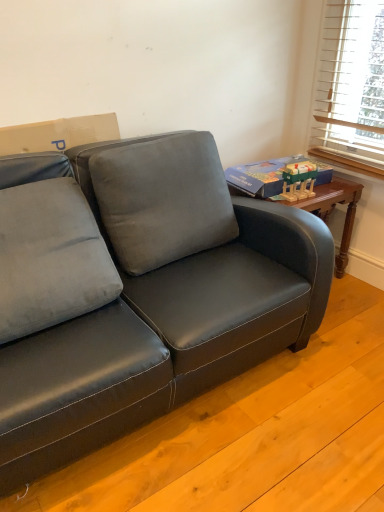
What is the approximate height of wooden block toy at upper right?

7.66 inches.

What do you see at coordinates (143, 291) in the screenshot?
I see `satin black couch at lower left` at bounding box center [143, 291].

Locate an element on the screen. The height and width of the screenshot is (512, 384). wooden block toy at upper right is located at coordinates 298,180.

Does velvet gray pillow at center, arranged as the first pillow when viewed from the right, appear on the left side of wooden block toy at upper right?

Correct, you'll find velvet gray pillow at center, arranged as the first pillow when viewed from the right, to the left of wooden block toy at upper right.

Would you say velvet gray pillow at center, the 2th pillow in the left-to-right sequence, is inside or outside wooden block toy at upper right?

The correct answer is: outside.

From the image's perspective, is velvet gray pillow at center, arranged as the first pillow when viewed from the right, positioned above or below wooden block toy at upper right?

velvet gray pillow at center, arranged as the first pillow when viewed from the right, is below wooden block toy at upper right.

Is point (125, 373) more distant than point (27, 194)?

No, it is not.

Is satin black couch at lower left in contact with suede-like gray pillow at left, arranged as the 2th pillow when viewed from the right?

satin black couch at lower left and suede-like gray pillow at left, arranged as the 2th pillow when viewed from the right, are not in contact.

How different are the orientations of satin black couch at lower left and suede-like gray pillow at left, acting as the 1th pillow starting from the left, in degrees?

The angle between the facing direction of satin black couch at lower left and the facing direction of suede-like gray pillow at left, acting as the 1th pillow starting from the left, is 92 degrees.

How much distance is there between satin black couch at lower left and suede-like gray pillow at left, arranged as the 2th pillow when viewed from the right?

satin black couch at lower left and suede-like gray pillow at left, arranged as the 2th pillow when viewed from the right, are 21.08 centimeters apart.

Who is taller, wooden block toy at upper right or velvet gray pillow at center, arranged as the first pillow when viewed from the right?

With more height is velvet gray pillow at center, arranged as the first pillow when viewed from the right.

Does wooden block toy at upper right touch velvet gray pillow at center, arranged as the first pillow when viewed from the right?

wooden block toy at upper right is not next to velvet gray pillow at center, arranged as the first pillow when viewed from the right, and they're not touching.

Who is smaller, wooden block toy at upper right or velvet gray pillow at center, arranged as the first pillow when viewed from the right?

Smaller between the two is wooden block toy at upper right.

Does blue cardboard book at upper right have a larger size compared to satin black couch at lower left?

No.

From the image's perspective, between blue cardboard book at upper right and satin black couch at lower left, which one is located above?

From the image's view, blue cardboard book at upper right is above.

Is blue cardboard book at upper right far from satin black couch at lower left?

They are positioned close to each other.

Which is more to the left, blue cardboard book at upper right or satin black couch at lower left?

Positioned to the left is satin black couch at lower left.

Is velvet gray pillow at center, the 2th pillow in the left-to-right sequence, shorter than blue cardboard book at upper right?

Incorrect, the height of velvet gray pillow at center, the 2th pillow in the left-to-right sequence, does not fall short of that of blue cardboard book at upper right.

Can you see velvet gray pillow at center, the 2th pillow in the left-to-right sequence, touching blue cardboard book at upper right?

No, velvet gray pillow at center, the 2th pillow in the left-to-right sequence, is not making contact with blue cardboard book at upper right.

From the image's perspective, is velvet gray pillow at center, the 2th pillow in the left-to-right sequence, beneath blue cardboard book at upper right?

Yes, from the image's perspective, velvet gray pillow at center, the 2th pillow in the left-to-right sequence, is below blue cardboard book at upper right.

I want to click on toy behind the suede-like gray pillow at left, arranged as the 2th pillow when viewed from the right, so click(x=298, y=180).

Which of these two, suede-like gray pillow at left, arranged as the 2th pillow when viewed from the right, or wooden block toy at upper right, is wider?

With larger width is suede-like gray pillow at left, arranged as the 2th pillow when viewed from the right.

Can you confirm if suede-like gray pillow at left, arranged as the 2th pillow when viewed from the right, is shorter than wooden block toy at upper right?

In fact, suede-like gray pillow at left, arranged as the 2th pillow when viewed from the right, may be taller than wooden block toy at upper right.

How many degrees apart are the facing directions of suede-like gray pillow at left, acting as the 1th pillow starting from the left, and wooden block toy at upper right?

They differ by 0.349 degrees in their facing directions.

From the image's perspective, relative to wooden block toy at upper right, is blue cardboard book at upper right above or below?

blue cardboard book at upper right is situated higher than wooden block toy at upper right in the image.

Looking at this image, which of these two, blue cardboard book at upper right or wooden block toy at upper right, is thinner?

With smaller width is wooden block toy at upper right.

Visually, is blue cardboard book at upper right positioned to the left or to the right of wooden block toy at upper right?

Based on their positions, blue cardboard book at upper right is located to the left of wooden block toy at upper right.

Which object is further away from the camera, blue cardboard book at upper right or wooden block toy at upper right?

blue cardboard book at upper right is further from the camera.

Locate an element on the screen. The image size is (384, 512). the 1st pillow counting from the left side of the wooden block toy at upper right is located at coordinates (161, 198).

This screenshot has width=384, height=512. What are the coordinates of `the 1st pillow above the satin black couch at lower left (from a real-world perspective)` in the screenshot? It's located at pyautogui.click(x=48, y=247).

When comparing their distances from suede-like gray pillow at left, arranged as the 2th pillow when viewed from the right, does satin black couch at lower left or blue cardboard book at upper right seem further?

blue cardboard book at upper right lies further to suede-like gray pillow at left, arranged as the 2th pillow when viewed from the right, than the other object.

Which object lies nearer to the anchor point satin black couch at lower left, wooden block toy at upper right or velvet gray pillow at center, the 2th pillow in the left-to-right sequence?

The object closer to satin black couch at lower left is velvet gray pillow at center, the 2th pillow in the left-to-right sequence.

Based on their spatial positions, is wooden block toy at upper right or satin black couch at lower left closer to blue cardboard book at upper right?

Among the two, wooden block toy at upper right is located nearer to blue cardboard book at upper right.

From the image, which object appears to be farther from suede-like gray pillow at left, arranged as the 2th pillow when viewed from the right, wooden block toy at upper right or satin black couch at lower left?

wooden block toy at upper right lies further to suede-like gray pillow at left, arranged as the 2th pillow when viewed from the right, than the other object.

From the image, which object appears to be nearer to velvet gray pillow at center, arranged as the first pillow when viewed from the right, suede-like gray pillow at left, arranged as the 2th pillow when viewed from the right, or blue cardboard book at upper right?

suede-like gray pillow at left, arranged as the 2th pillow when viewed from the right.

From the image, which object appears to be nearer to wooden block toy at upper right, blue cardboard book at upper right or suede-like gray pillow at left, arranged as the 2th pillow when viewed from the right?

Among the two, blue cardboard book at upper right is located nearer to wooden block toy at upper right.

Based on their spatial positions, is velvet gray pillow at center, arranged as the first pillow when viewed from the right, or blue cardboard book at upper right further from suede-like gray pillow at left, acting as the 1th pillow starting from the left?

blue cardboard book at upper right lies further to suede-like gray pillow at left, acting as the 1th pillow starting from the left, than the other object.

When comparing their distances from velvet gray pillow at center, arranged as the first pillow when viewed from the right, does suede-like gray pillow at left, acting as the 1th pillow starting from the left, or satin black couch at lower left seem closer?

Among the two, satin black couch at lower left is located nearer to velvet gray pillow at center, arranged as the first pillow when viewed from the right.

At what (x,y) coordinates should I click in order to perform the action: click on paperback book between suede-like gray pillow at left, acting as the 1th pillow starting from the left, and wooden block toy at upper right from left to right. Please return your answer as a coordinate pair (x, y). Looking at the image, I should click on (260, 176).

Identify the location of toy between satin black couch at lower left and blue cardboard book at upper right from front to back. Image resolution: width=384 pixels, height=512 pixels. (298, 180).

Where is `pillow between suede-like gray pillow at left, arranged as the 2th pillow when viewed from the right, and satin black couch at lower left, in the horizontal direction`? pillow between suede-like gray pillow at left, arranged as the 2th pillow when viewed from the right, and satin black couch at lower left, in the horizontal direction is located at coordinates (161, 198).

Find the location of a particular element. pillow situated between suede-like gray pillow at left, arranged as the 2th pillow when viewed from the right, and blue cardboard book at upper right from left to right is located at coordinates (161, 198).